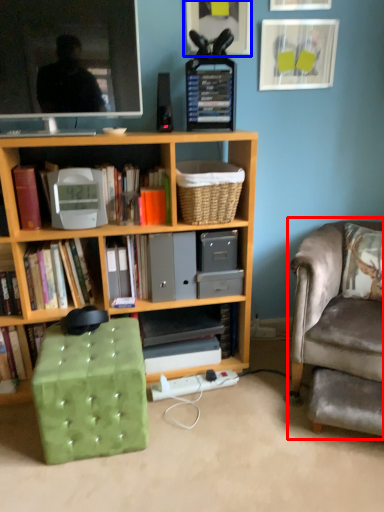
Question: Which object appears farthest to the camera in this image, chair (highlighted by a red box) or picture frame (highlighted by a blue box)?

Choices:
 (A) chair
 (B) picture frame

Answer: (B)